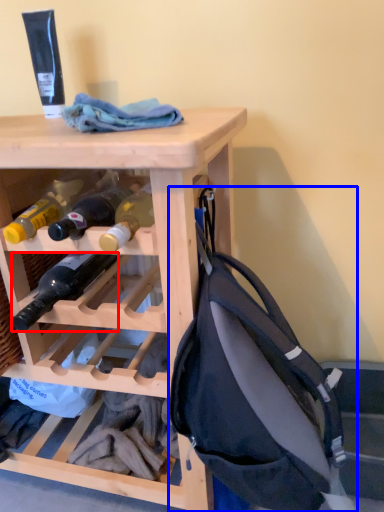
Question: Which of the following is the farthest to the observer, bottle (highlighted by a red box) or backpack (highlighted by a blue box)?

Choices:
 (A) bottle
 (B) backpack

Answer: (A)